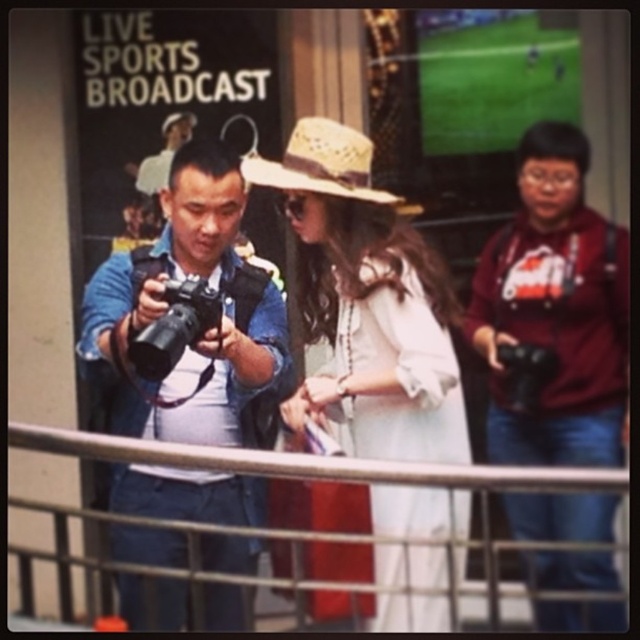
You are standing at the balcony and want to take a photo of the white cotton dress at center. Where should you aim your camera to capture it?

You should aim your camera at point 0.477 on the x coordinate and 0.573 on the y coordinate to capture the white cotton dress at center.